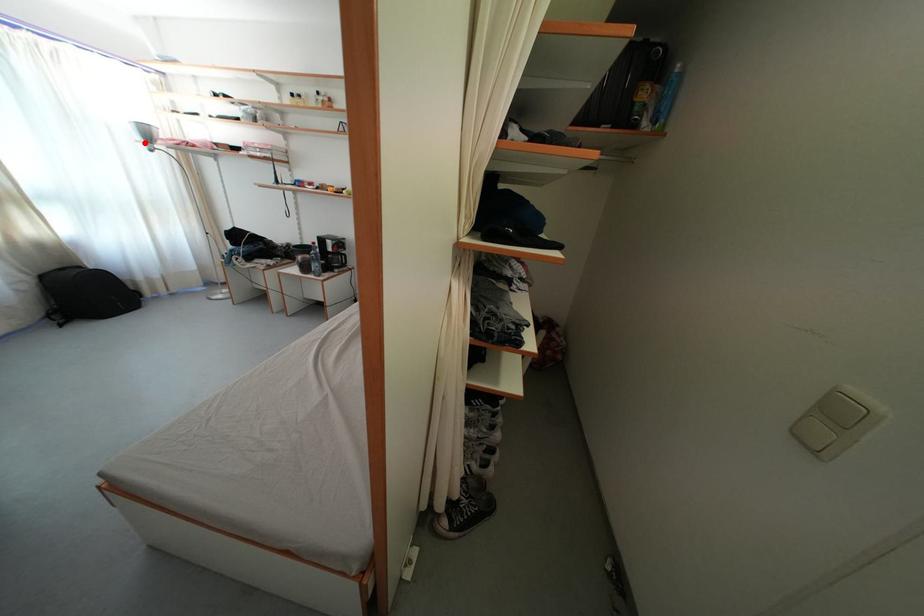
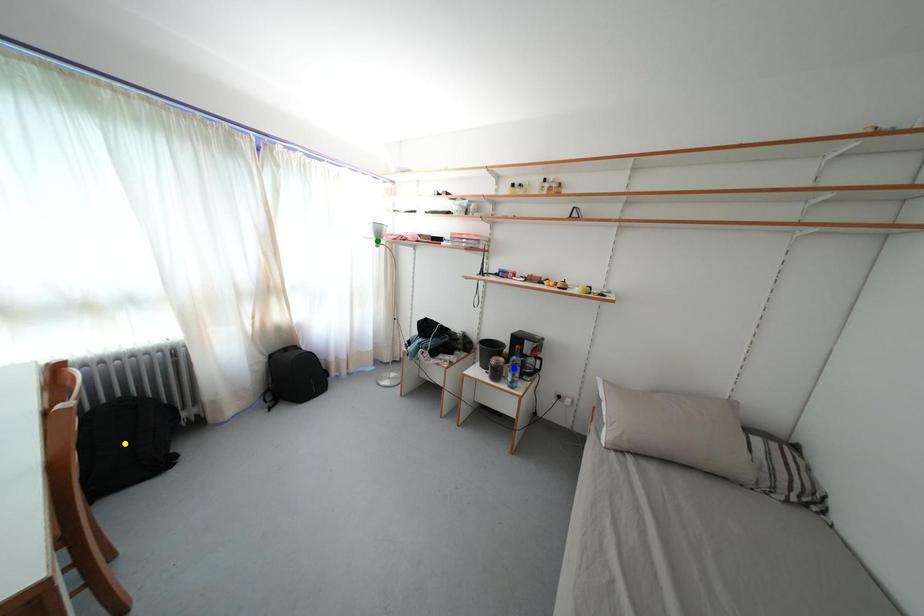
Question: I am providing you with two images of the same scene from different viewpoints. A red point is marked on the first image. You are given multiple points on the second image. Which point in image 2 represents the same 3d spot as the red point in image 1?

Choices:
 (A) blue point
 (B) green point
 (C) yellow point

Answer: (B)